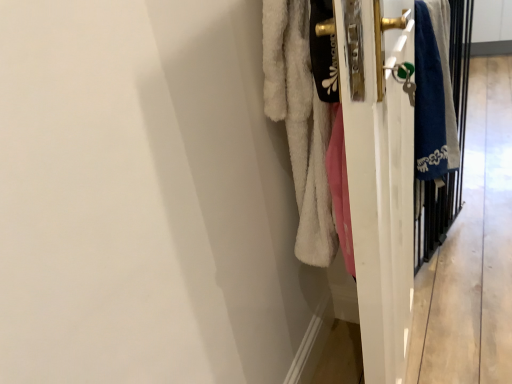
Question: In terms of width, does blue towel at right look wider or thinner when compared to white fluffy towel at right?

Choices:
 (A) wide
 (B) thin

Answer: (B)

Question: Considering the positions of blue towel at right and white fluffy towel at right in the image, is blue towel at right taller or shorter than white fluffy towel at right?

Choices:
 (A) tall
 (B) short

Answer: (B)

Question: Estimate the real-world distances between objects in this image. Which object is closer to the blue fabric screen door at right?

Choices:
 (A) blue towel at right
 (B) white fluffy towel at right

Answer: (B)

Question: Which object is positioned closest to the blue towel at right?

Choices:
 (A) blue fabric screen door at right
 (B) white fluffy towel at right

Answer: (A)